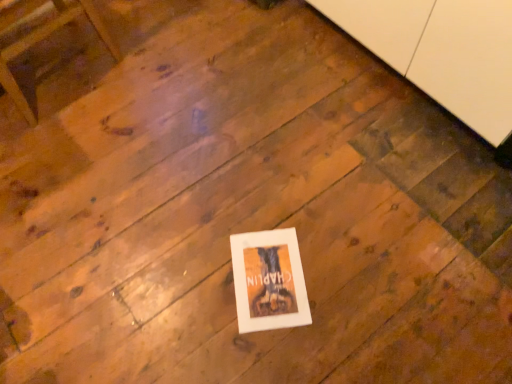
Image resolution: width=512 pixels, height=384 pixels. In order to click on vacant area that lies to the right of wooden chair at upper left in this screenshot , I will do `click(155, 87)`.